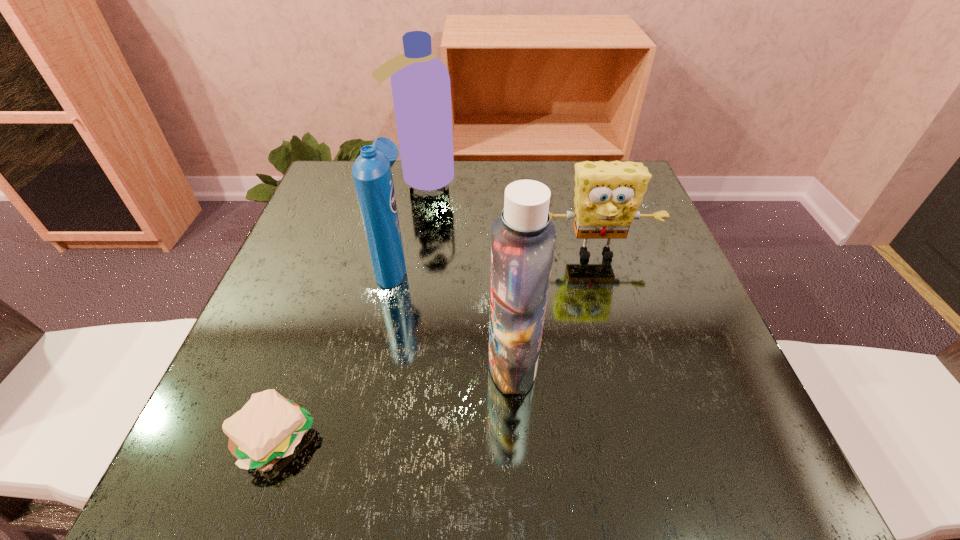
At what (x,y) coordinates should I click in order to perform the action: click on the farthest shampoo. Please return your answer as a coordinate pair (x, y). Image resolution: width=960 pixels, height=540 pixels. Looking at the image, I should click on (420, 82).

Image resolution: width=960 pixels, height=540 pixels. Identify the location of the second nearest object. (523, 241).

Locate an element on the screen. the rightmost shampoo is located at coordinates (523, 241).

The width and height of the screenshot is (960, 540). Identify the location of the third tallest object. [371, 171].

Where is `the shortest shampoo`? This screenshot has height=540, width=960. the shortest shampoo is located at coordinates (371, 171).

Locate an element on the screen. sponge is located at coordinates (607, 194).

The width and height of the screenshot is (960, 540). I want to click on the second shortest object, so click(x=607, y=194).

Where is `the nearest object`? The image size is (960, 540). the nearest object is located at coordinates (268, 428).

In order to click on the leftmost object in this screenshot , I will do `click(268, 428)`.

The image size is (960, 540). I want to click on free spot located on the right of the farthest object, so (477, 179).